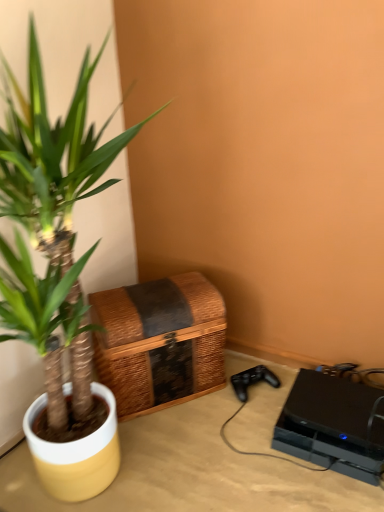
Question: Looking at their shapes, would you say woven brown basket at lower left is wider or thinner than green leafy plant at left?

Choices:
 (A) thin
 (B) wide

Answer: (A)

Question: Considering the relative positions of woven brown basket at lower left and green leafy plant at left in the image provided, is woven brown basket at lower left to the left or to the right of green leafy plant at left?

Choices:
 (A) left
 (B) right

Answer: (B)

Question: Considering the real-world distances, which object is closest to the beige wood table at lower right?

Choices:
 (A) green leafy plant at left
 (B) black matte gaming console at lower right
 (C) woven brown basket at lower left

Answer: (B)

Question: Which is farther from the woven brown basket at lower left?

Choices:
 (A) black matte gaming console at lower right
 (B) green leafy plant at left
 (C) beige wood table at lower right

Answer: (A)